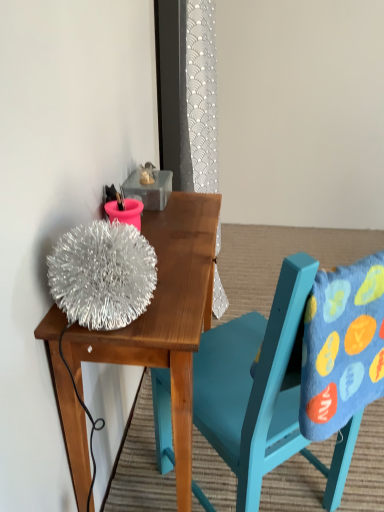
Question: From a real-world perspective, is shiny metallic ball at upper left positioned above or below teal painted wood chair at upper center?

Choices:
 (A) above
 (B) below

Answer: (B)

Question: Is shiny metallic ball at upper left wider or thinner than teal painted wood chair at upper center?

Choices:
 (A) thin
 (B) wide

Answer: (A)

Question: Which object is the closest to the shiny metallic ball at upper left?

Choices:
 (A) blue felt pillow at right
 (B) teal painted wood chair at upper center

Answer: (B)

Question: Considering the real-world distances, which object is closest to the blue felt pillow at right?

Choices:
 (A) shiny metallic ball at upper left
 (B) teal painted wood chair at upper center

Answer: (B)